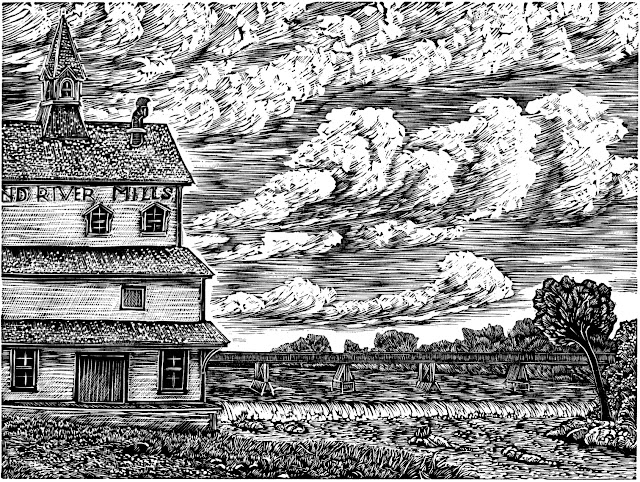
At what (x,y) coordinates should I click in order to perform the action: click on floor. Please return your answer as a coordinate pair (x, y). Looking at the image, I should click on (54, 456).